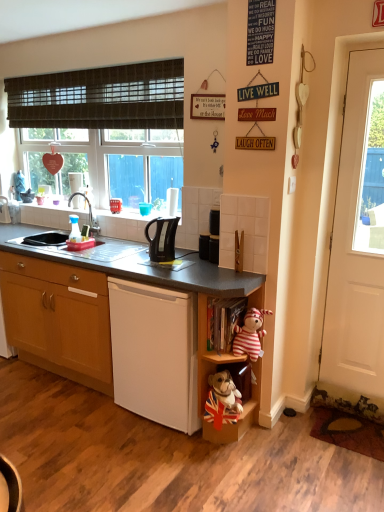
Question: From the image's perspective, is striped fabric stuffed animal at lower right above or below black plastic kettle at center?

Choices:
 (A) below
 (B) above

Answer: (A)

Question: Do you think striped fabric stuffed animal at lower right is within black plastic kettle at center, or outside of it?

Choices:
 (A) inside
 (B) outside

Answer: (B)

Question: Considering the real-world distances, which object is closest to the white matte dishwasher at center?

Choices:
 (A) wooden cabinet at lower left
 (B) brown woven curtain at upper left
 (C) striped fabric stuffed animal at lower right
 (D) white wooden door at right
 (E) brushed metal faucet at upper left

Answer: (A)

Question: Estimate the real-world distances between objects in this image. Which object is closer to the white wooden door at right?

Choices:
 (A) brown woven curtain at upper left
 (B) striped fabric stuffed animal at lower right
 (C) wooden bookshelf at lower center, which ranks as the first shelf in top-to-bottom order
 (D) black plastic kettle at center
 (E) wooden cabinet at lower left

Answer: (B)